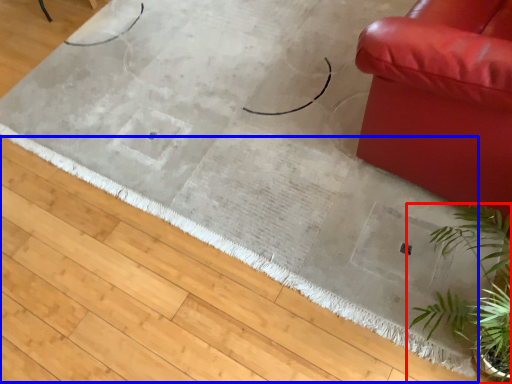
Question: Among these objects, which one is farthest to the camera, houseplant (highlighted by a red box) or doormat (highlighted by a blue box)?

Choices:
 (A) houseplant
 (B) doormat

Answer: (B)